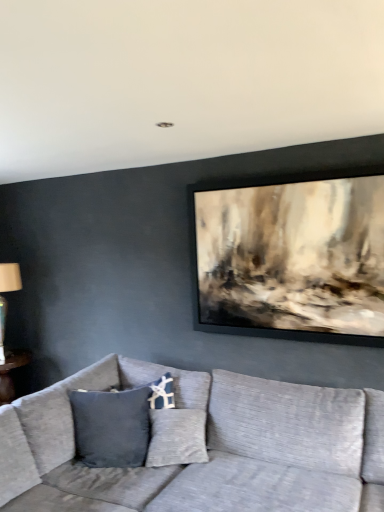
Question: Considering the positions of textured gray couch at center and white fabric lampshade at left in the image, is textured gray couch at center wider or thinner than white fabric lampshade at left?

Choices:
 (A) wide
 (B) thin

Answer: (A)

Question: Relative to white fabric lampshade at left, is textured gray couch at center in front or behind?

Choices:
 (A) behind
 (B) front

Answer: (B)

Question: In terms of height, does textured gray couch at center look taller or shorter compared to white fabric lampshade at left?

Choices:
 (A) tall
 (B) short

Answer: (B)

Question: Considering the positions of white fabric lampshade at left and textured gray couch at center in the image, is white fabric lampshade at left bigger or smaller than textured gray couch at center?

Choices:
 (A) big
 (B) small

Answer: (B)

Question: Is white fabric lampshade at left taller or shorter than textured gray couch at center?

Choices:
 (A) tall
 (B) short

Answer: (A)

Question: From a real-world perspective, is white fabric lampshade at left positioned above or below textured gray couch at center?

Choices:
 (A) above
 (B) below

Answer: (A)

Question: Which is correct: white fabric lampshade at left is inside textured gray couch at center, or outside of it?

Choices:
 (A) inside
 (B) outside

Answer: (B)